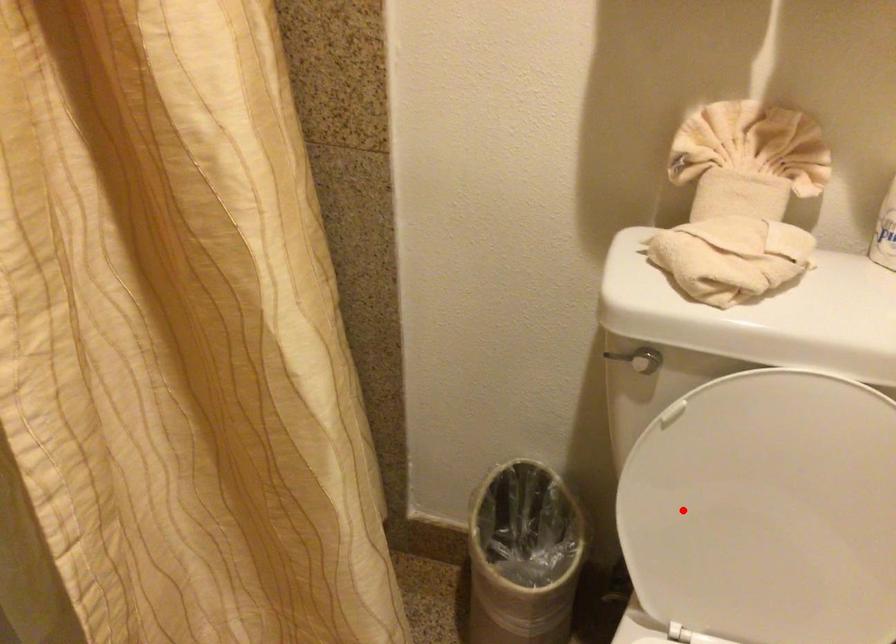
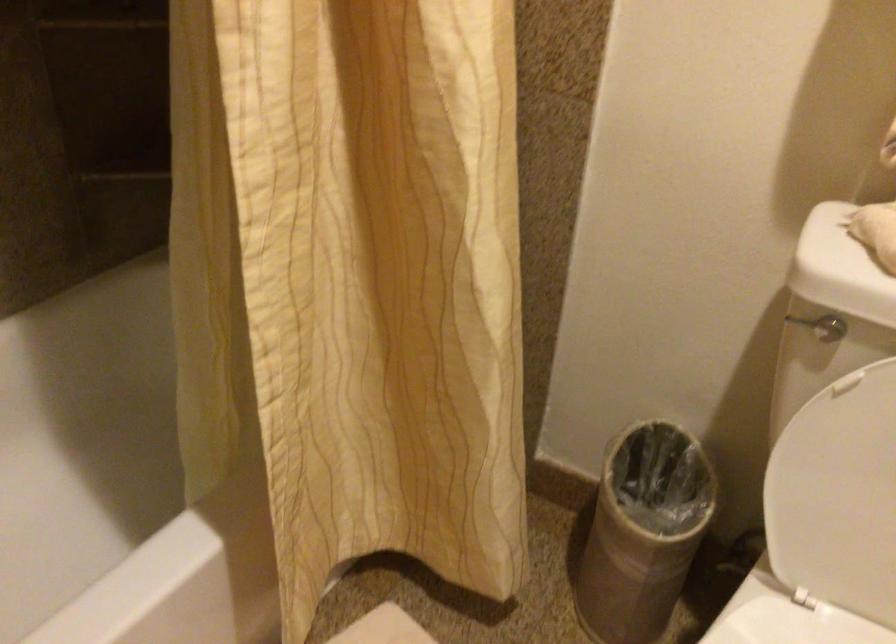
Find the pixel in the second image that matches the highlighted location in the first image.

(834, 480)